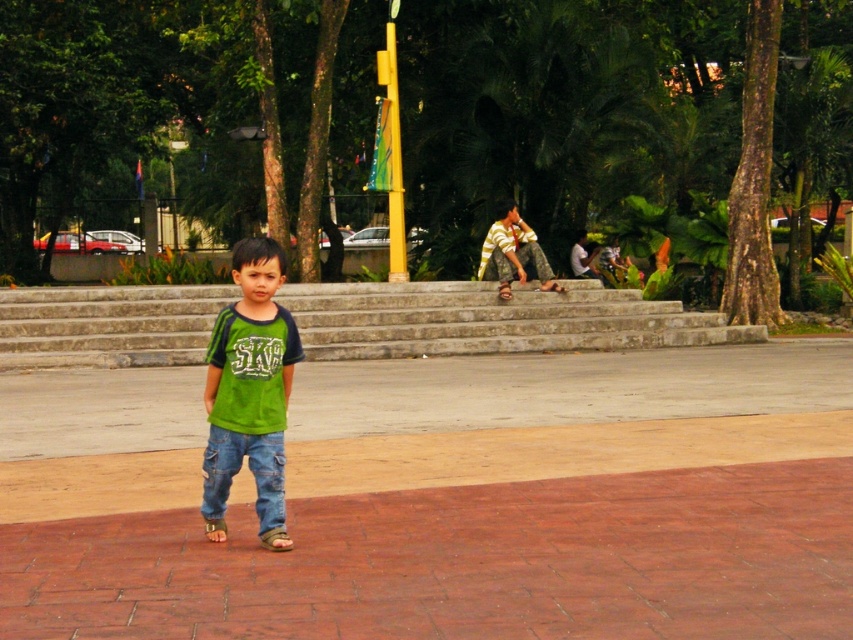
You are standing at the position of the child in the scene. If you want to walk towards the gray stone stairs at center, which direction should you move?

Since the gray stone stairs at center is located at point [491,321] in the image, you should move forward from the child position to reach them.

You are a photographer trying to capture a group photo of the green cotton shirt at center and the yellow striped shirt at center. Which shirt should you focus on first if you want to ensure both are in frame without moving the camera?

The green cotton shirt at center has a smaller size compared to yellow striped shirt at center, so you should focus on the yellow striped shirt at center first to ensure the smaller green cotton shirt at center fits within the frame.